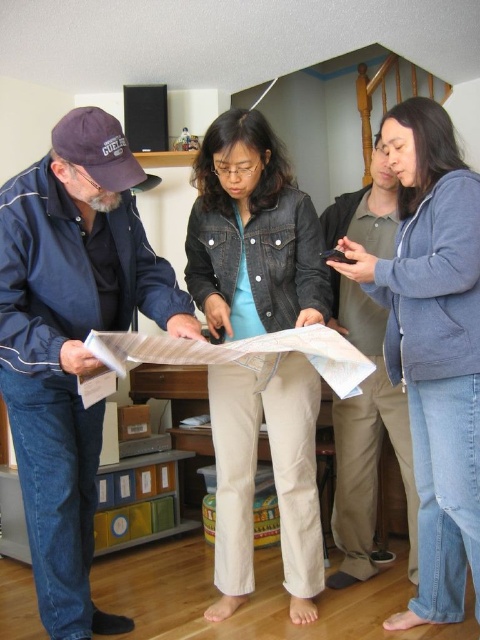
You are standing at the origin point in the room. You need to locate the blue fleece jacket at upper right. Which direction should you move to reach it?

The blue fleece jacket at upper right is located at point (432, 346), so you should move towards the upper right direction from your current position at the origin to reach it.

You are standing in the room and want to hand a document to the person in the denim jacket at center. Which direction should you move relative to the blue fabric jacket at left?

The blue fabric jacket at left is to the left of the denim jacket at center. Therefore, to reach the denim jacket at center, you should move to the right from the blue fabric jacket at left.